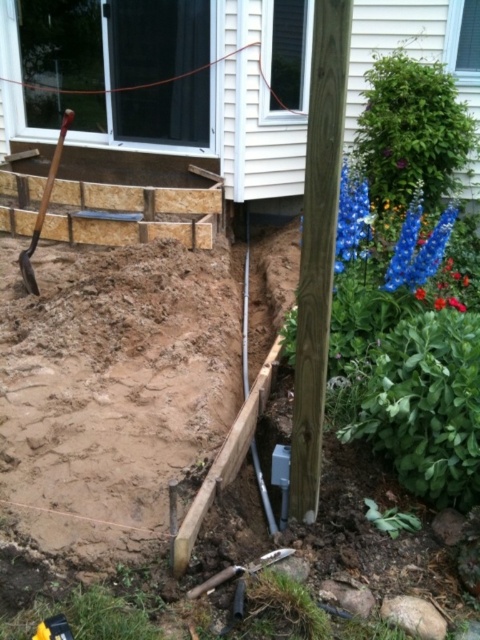
Question: In this image, where is brown wood pole at center located relative to wooden shovel at left?

Choices:
 (A) below
 (B) above

Answer: (A)

Question: Among these objects, which one is nearest to the camera?

Choices:
 (A) brown wood pole at center
 (B) wooden shovel at left

Answer: (A)

Question: In this image, where is brown wood pole at center located relative to wooden shovel at left?

Choices:
 (A) above
 (B) below

Answer: (B)

Question: Is the position of brown wood pole at center less distant than that of wooden shovel at left?

Choices:
 (A) no
 (B) yes

Answer: (B)

Question: Which point is farther to the camera?

Choices:
 (A) wooden shovel at left
 (B) brown wood pole at center

Answer: (A)